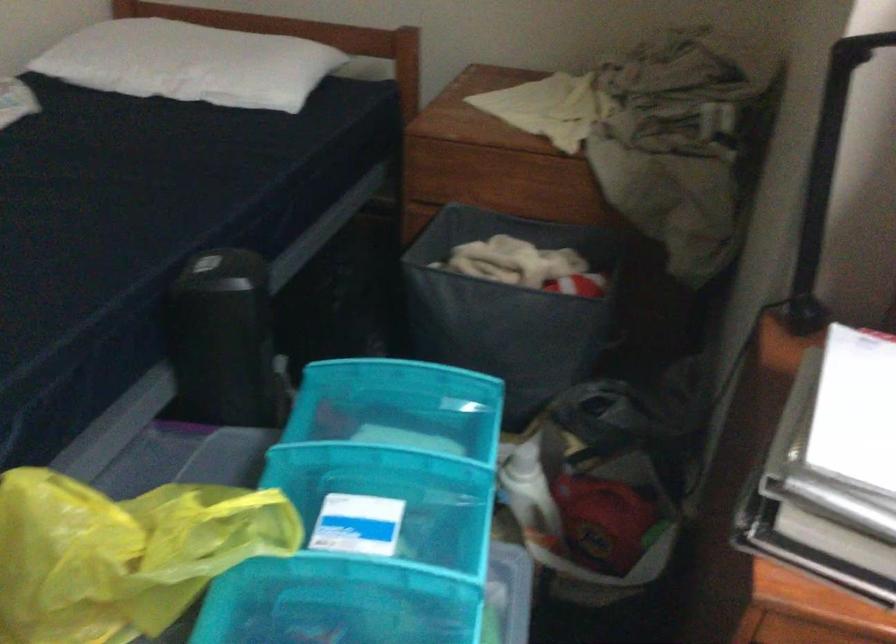
The height and width of the screenshot is (644, 896). What do you see at coordinates (225, 268) in the screenshot?
I see `the trash can lid` at bounding box center [225, 268].